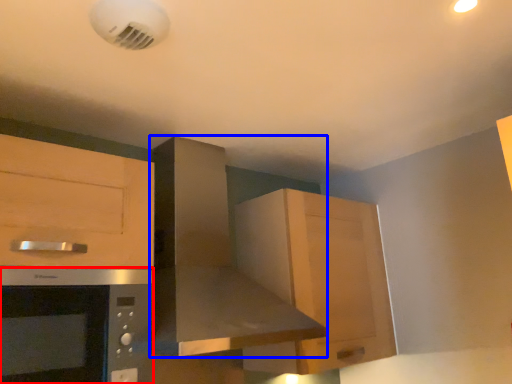
Question: Which object is closer to the camera taking this photo, microwave oven (highlighted by a red box) or home appliance (highlighted by a blue box)?

Choices:
 (A) microwave oven
 (B) home appliance

Answer: (A)